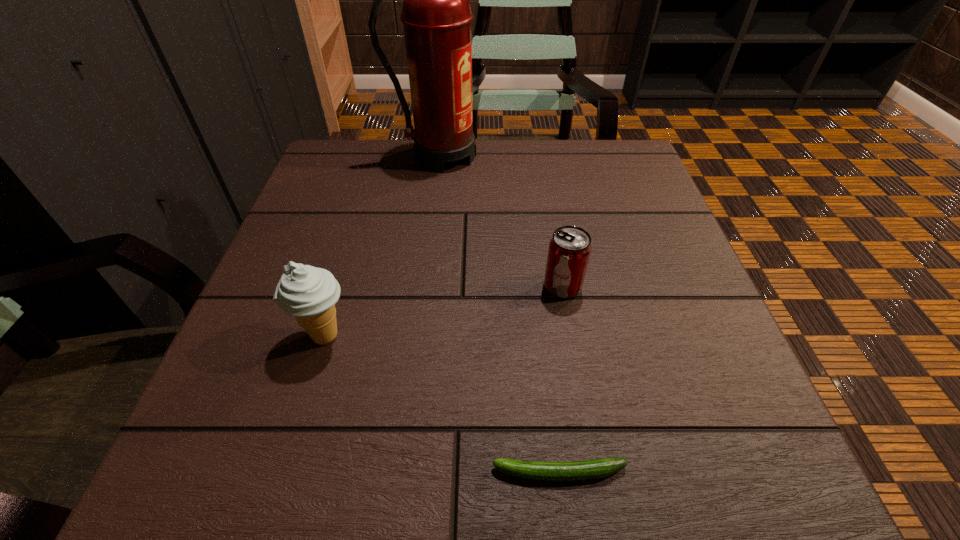
Where is `free space located on the back of the third nearest object`? Image resolution: width=960 pixels, height=540 pixels. free space located on the back of the third nearest object is located at coordinates (544, 184).

Find the location of a particular element. The width and height of the screenshot is (960, 540). vacant space located 0.230m on the front-facing side of the zucchini is located at coordinates (315, 472).

Locate an element on the screen. free space located 0.250m on the front-facing side of the zucchini is located at coordinates (300, 472).

This screenshot has width=960, height=540. What are the coordinates of `vacant space located on the front-facing side of the zucchini` in the screenshot? It's located at (384, 472).

Image resolution: width=960 pixels, height=540 pixels. Find the location of `object that is at the far edge`. object that is at the far edge is located at coordinates (436, 14).

Locate an element on the screen. The height and width of the screenshot is (540, 960). object present at the near edge is located at coordinates (598, 468).

Where is `object located in the left edge section of the desktop`? object located in the left edge section of the desktop is located at coordinates (309, 294).

Where is `vacant space at the far edge`? The height and width of the screenshot is (540, 960). vacant space at the far edge is located at coordinates (527, 161).

Identify the location of vacant space at the near edge of the desktop. (305, 487).

This screenshot has height=540, width=960. I want to click on vacant space at the left edge of the desktop, so click(x=297, y=373).